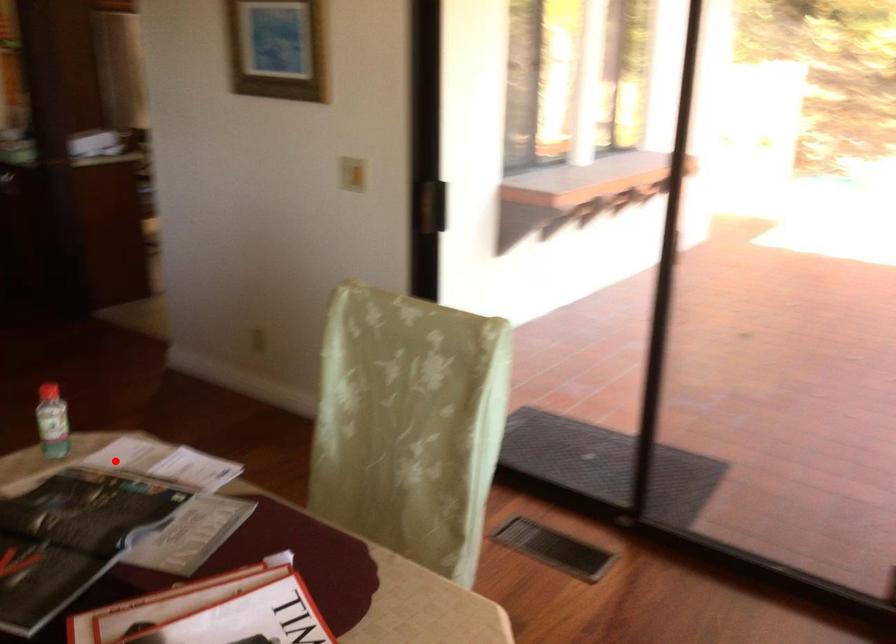
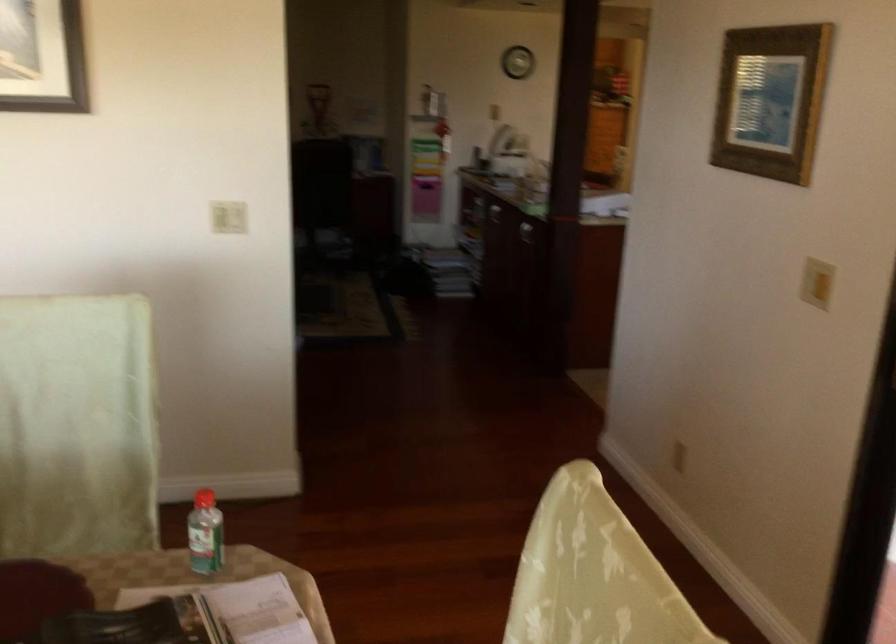
Locate, in the second image, the point that corresponds to the highlighted location in the first image.

(238, 609)